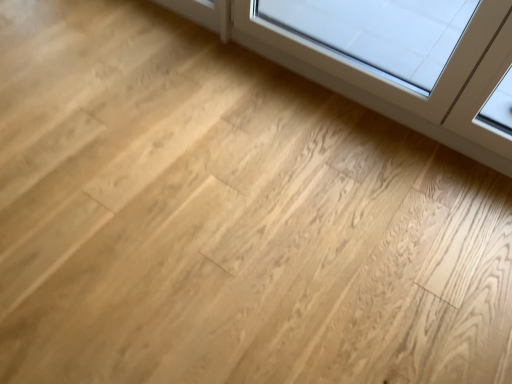
You are a GUI agent. You are given a task and a screenshot of the screen. Output one action in this format:
    pyautogui.click(x=<x>, y=<y>)
    Task: Click on the free space to the left of transparent glass window at upper right
    This screenshot has width=512, height=384.
    Given the screenshot: What is the action you would take?
    pyautogui.click(x=188, y=114)